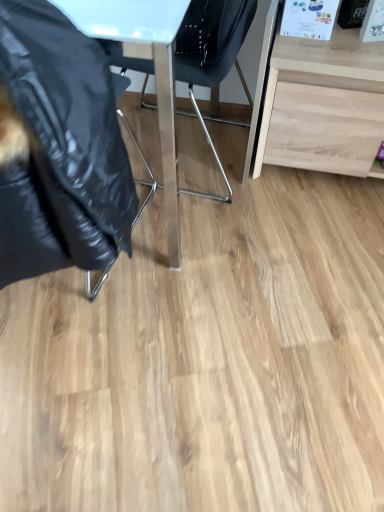
Question: Is light wood desk at right thinner than metallic blue chair at center, arranged as the second chair when viewed from the left?

Choices:
 (A) no
 (B) yes

Answer: (B)

Question: Does light wood desk at right appear on the left side of metallic blue chair at center, placed as the first chair when sorted from right to left?

Choices:
 (A) yes
 (B) no

Answer: (B)

Question: Considering the relative sizes of light wood desk at right and metallic blue chair at center, placed as the first chair when sorted from right to left, in the image provided, is light wood desk at right smaller than metallic blue chair at center, placed as the first chair when sorted from right to left,?

Choices:
 (A) yes
 (B) no

Answer: (A)

Question: Considering the relative sizes of light wood desk at right and metallic blue chair at center, placed as the first chair when sorted from right to left, in the image provided, is light wood desk at right shorter than metallic blue chair at center, placed as the first chair when sorted from right to left,?

Choices:
 (A) yes
 (B) no

Answer: (A)

Question: From a real-world perspective, is light wood desk at right physically below metallic blue chair at center, arranged as the second chair when viewed from the left?

Choices:
 (A) no
 (B) yes

Answer: (B)

Question: Is light wood desk at right at the right side of metallic blue chair at center, placed as the first chair when sorted from right to left?

Choices:
 (A) no
 (B) yes

Answer: (B)

Question: From the image's perspective, does light wood desk at right appear higher than black glossy jacket at left, the first chair in the left-to-right sequence?

Choices:
 (A) no
 (B) yes

Answer: (B)

Question: Considering the relative sizes of light wood desk at right and black glossy jacket at left, which ranks as the 2th chair in right-to-left order, in the image provided, is light wood desk at right wider than black glossy jacket at left, which ranks as the 2th chair in right-to-left order,?

Choices:
 (A) no
 (B) yes

Answer: (B)

Question: Is light wood desk at right oriented away from black glossy jacket at left, which ranks as the 2th chair in right-to-left order?

Choices:
 (A) no
 (B) yes

Answer: (A)

Question: Does light wood desk at right have a larger size compared to black glossy jacket at left, the first chair in the left-to-right sequence?

Choices:
 (A) no
 (B) yes

Answer: (A)

Question: Is light wood desk at right smaller than black glossy jacket at left, the first chair in the left-to-right sequence?

Choices:
 (A) yes
 (B) no

Answer: (A)

Question: Does light wood desk at right turn towards black glossy jacket at left, the first chair in the left-to-right sequence?

Choices:
 (A) yes
 (B) no

Answer: (B)

Question: Considering the relative positions of black glossy jacket at left, the first chair in the left-to-right sequence, and metallic blue chair at center, placed as the first chair when sorted from right to left, in the image provided, is black glossy jacket at left, the first chair in the left-to-right sequence, to the left of metallic blue chair at center, placed as the first chair when sorted from right to left, from the viewer's perspective?

Choices:
 (A) yes
 (B) no

Answer: (A)